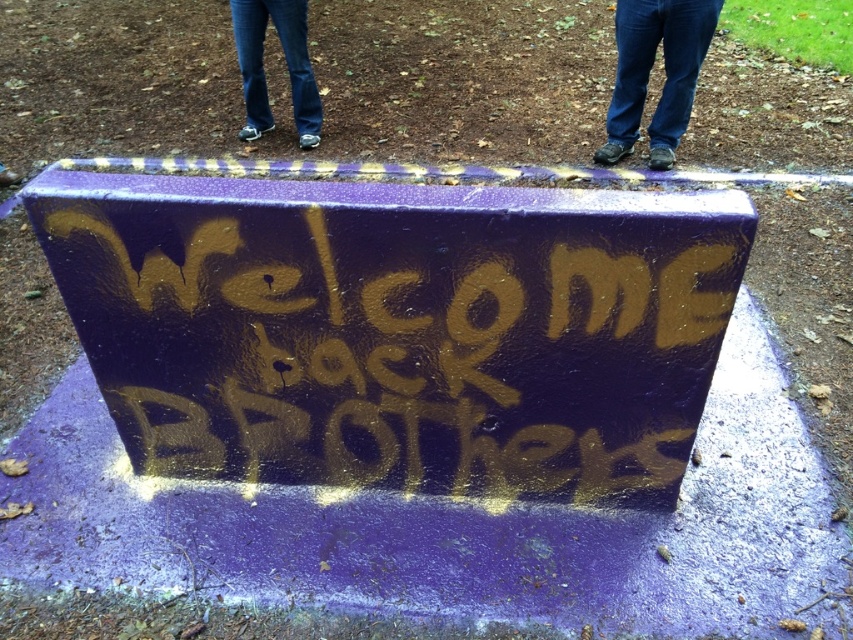
Question: Does gold spray paint graffiti at center appear on the right side of jeans at center?

Choices:
 (A) no
 (B) yes

Answer: (A)

Question: Which point is farther to the camera?

Choices:
 (A) (625, 96)
 (B) (259, 472)

Answer: (A)

Question: Can you confirm if jeans at center is positioned to the left of jeans at upper center?

Choices:
 (A) yes
 (B) no

Answer: (B)

Question: Which object is positioned closest to the jeans at upper center?

Choices:
 (A) gold spray paint graffiti at center
 (B) jeans at center

Answer: (B)

Question: Which point is farther from the camera taking this photo?

Choices:
 (A) (172, 360)
 (B) (671, 80)

Answer: (B)

Question: Is gold spray paint graffiti at center positioned behind jeans at center?

Choices:
 (A) no
 (B) yes

Answer: (A)